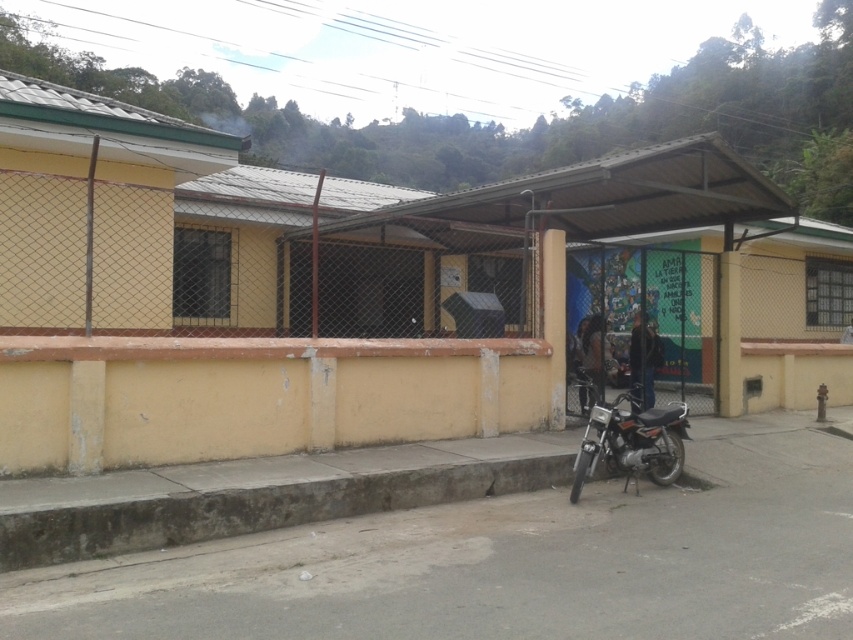
Is the position of concrete at lower left less distant than that of metallic silver motorcycle at lower right?

Yes, it is in front of metallic silver motorcycle at lower right.

Does concrete at lower left have a lesser width compared to metallic silver motorcycle at lower right?

In fact, concrete at lower left might be wider than metallic silver motorcycle at lower right.

The height and width of the screenshot is (640, 853). In order to click on concrete at lower left in this screenshot , I will do `click(254, 508)`.